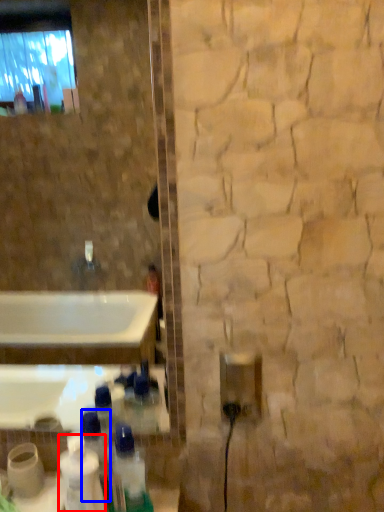
Question: Which point is closer to the camera, cleaning product (highlighted by a red box) or bottle (highlighted by a blue box)?

Choices:
 (A) cleaning product
 (B) bottle

Answer: (A)